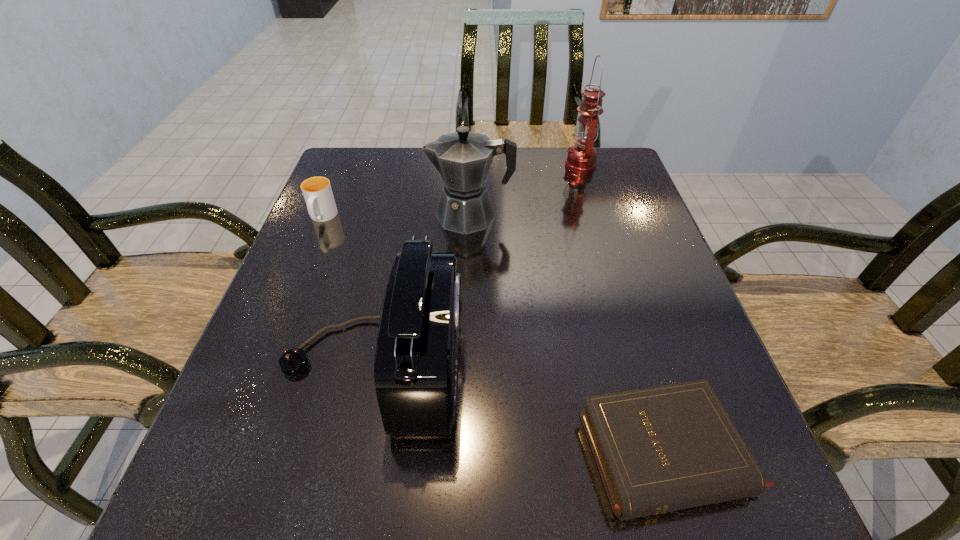
Where is `blank space located at the spout of the coffeepot`? The width and height of the screenshot is (960, 540). blank space located at the spout of the coffeepot is located at coordinates (388, 215).

The height and width of the screenshot is (540, 960). Find the location of `free space located 0.140m on the front-facing side of the radio receiver`. free space located 0.140m on the front-facing side of the radio receiver is located at coordinates (540, 361).

What are the coordinates of `vacant area located 0.050m with the handle on the side of the second shortest object` in the screenshot? It's located at (311, 245).

The height and width of the screenshot is (540, 960). What are the coordinates of `free space located on the back of the shortest object` in the screenshot? It's located at (615, 281).

The height and width of the screenshot is (540, 960). I want to click on object that is positioned at the far edge, so click(x=581, y=158).

The image size is (960, 540). Identify the location of object at the near edge. (660, 449).

Where is `radio receiver at the left edge`? The image size is (960, 540). radio receiver at the left edge is located at coordinates (415, 368).

This screenshot has width=960, height=540. What are the coordinates of `cup located in the left edge section of the desktop` in the screenshot? It's located at (317, 192).

You are a GUI agent. You are given a task and a screenshot of the screen. Output one action in this format:
    pyautogui.click(x=<x>, y=<y>)
    Task: Click on the oil lamp positioned at the right edge
    The width and height of the screenshot is (960, 540).
    Given the screenshot: What is the action you would take?
    pyautogui.click(x=581, y=158)

Locate an element on the screen. The width and height of the screenshot is (960, 540). Bible located at the right edge is located at coordinates (660, 449).